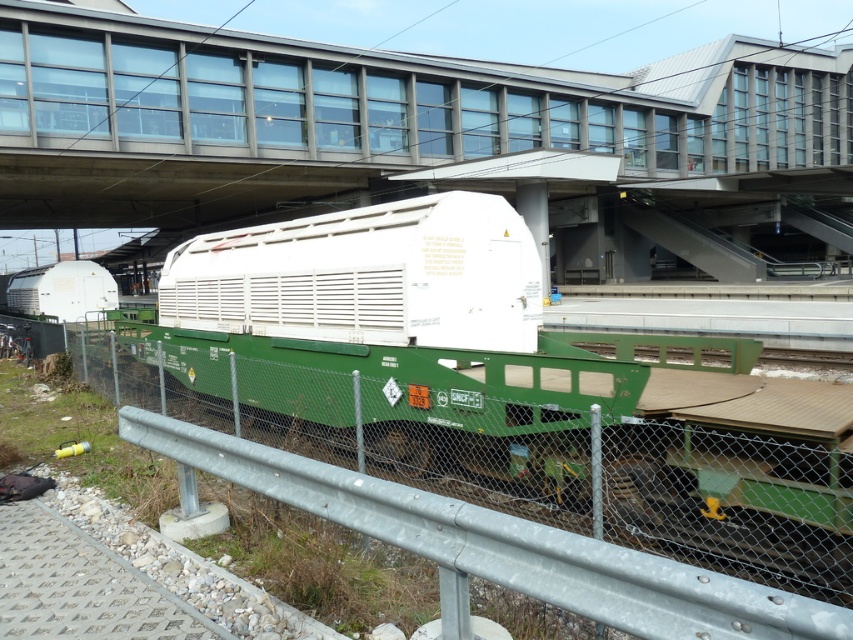
Consider the image. You are a crane operator trying to lift the white matte container at center and the metal at center using a 10m long crane arm. Given that the crane arm can only lift objects within its reach, can you determine which object is taller and needs to be lifted first?

The white matte container at center is taller than the metal at center. Since the crane arm is 10m long, you should lift the taller white matte container at center first to ensure it doesn not obstruct the lifting of the shorter metal at center.

You are a railway inspector checking the railcar. You notice the white matte container at center and the metal at center. Which object should you inspect first if the larger one requires immediate attention?

The white matte container at center is larger in size than the metal at center, so you should inspect the white matte container at center first.